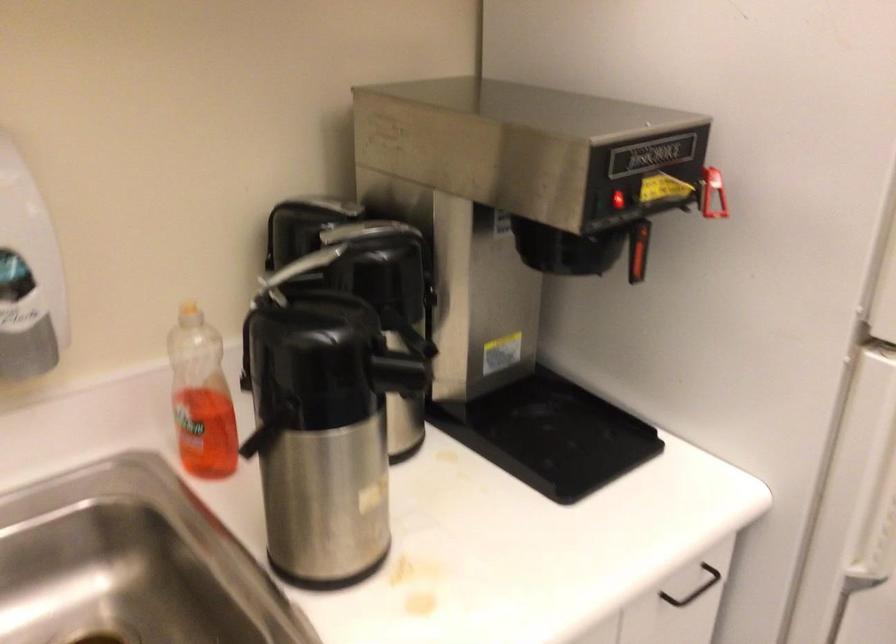
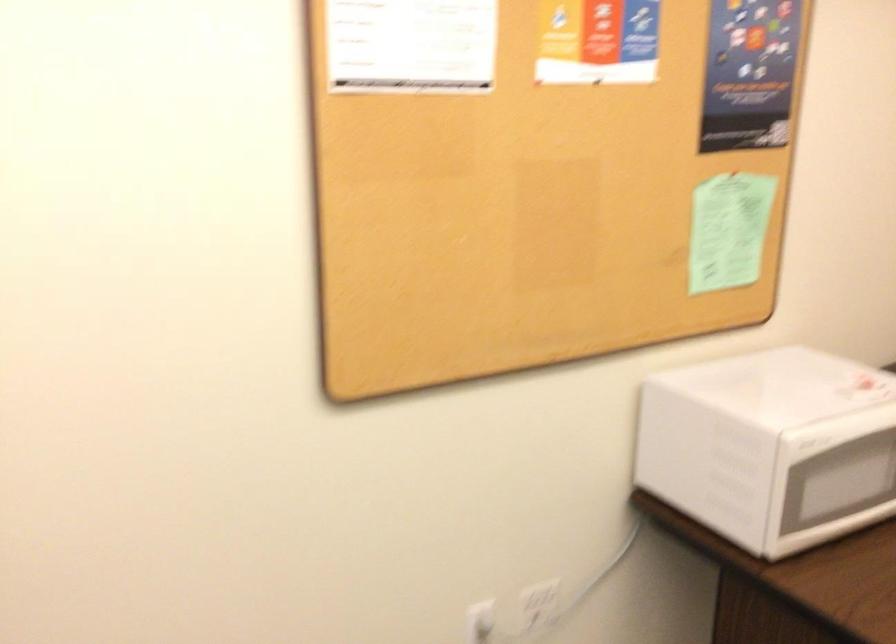
Question: The first image is from the beginning of the video and the second image is from the end. How did the camera likely rotate when shooting the video?

Choices:
 (A) Left
 (B) Right
 (C) Up
 (D) Down

Answer: (B)